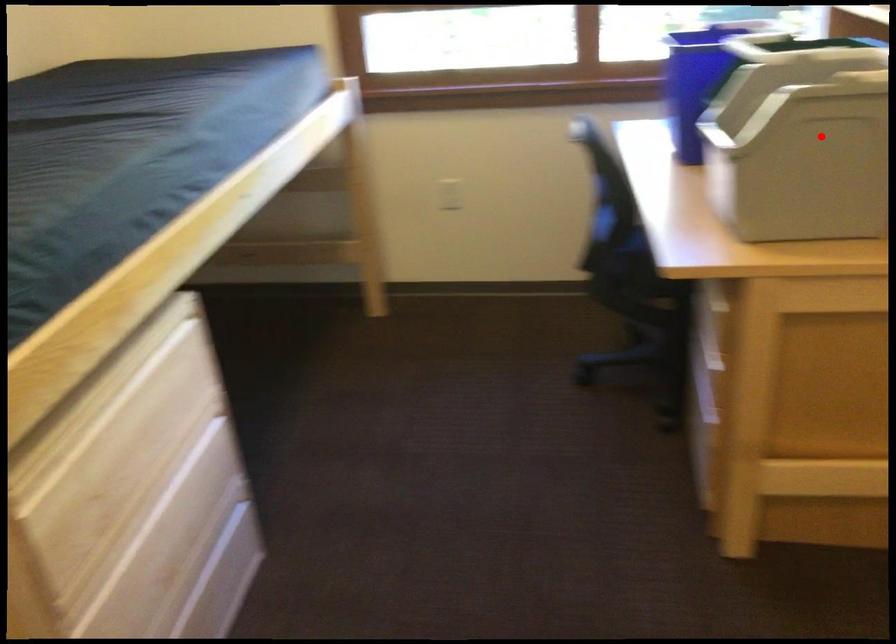
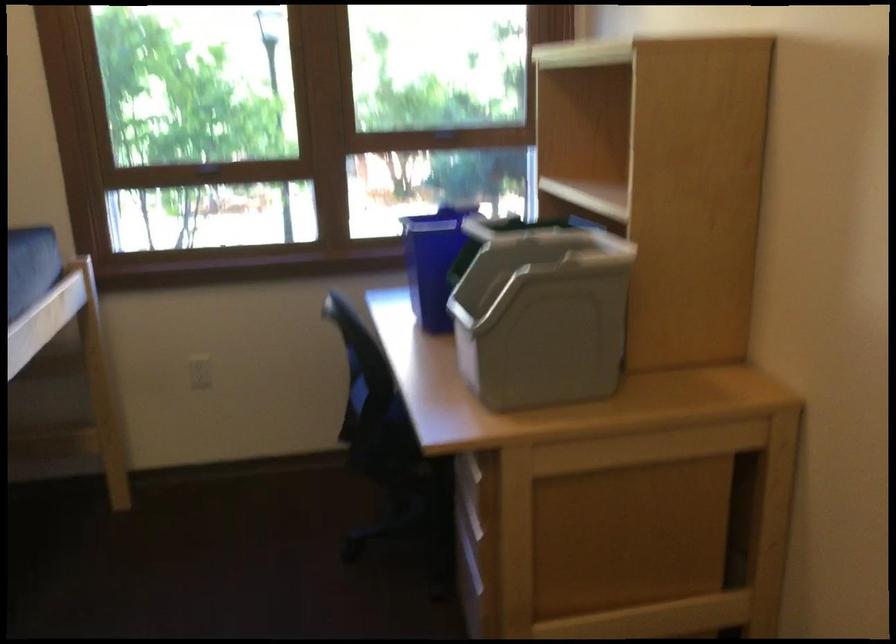
Find the pixel in the second image that matches the highlighted location in the first image.

(540, 313)